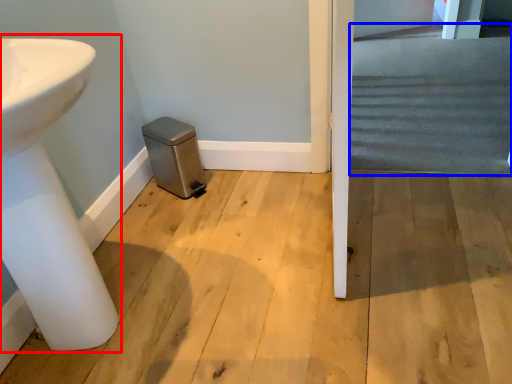
Question: Which object is closer to the camera taking this photo, sink (highlighted by a red box) or stairwell (highlighted by a blue box)?

Choices:
 (A) sink
 (B) stairwell

Answer: (A)